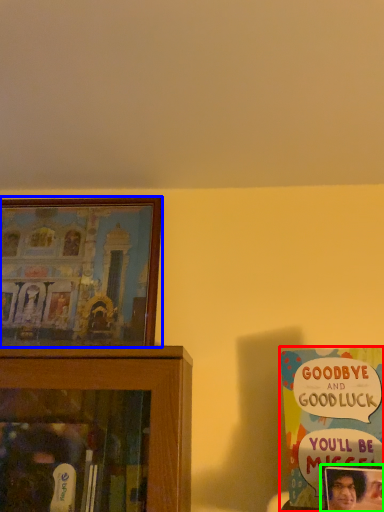
Question: Considering the real-world distances, which object is farthest from book (highlighted by a red box)? picture frame (highlighted by a blue box) or picture frame (highlighted by a green box)?

Choices:
 (A) picture frame
 (B) picture frame

Answer: (A)